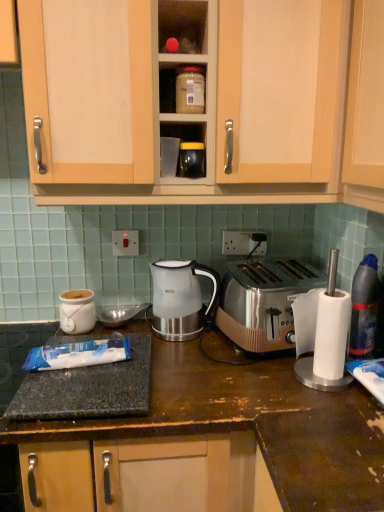
The width and height of the screenshot is (384, 512). I want to click on satin silver toaster at right, so click(328, 335).

In order to face satin silver kettle at center, should I rotate leftwards or rightwards?

To align with it, rotate left about 1.465°.

You are a GUI agent. You are given a task and a screenshot of the screen. Output one action in this format:
    pyautogui.click(x=<x>, y=<y>)
    Task: Click on the satin silver kettle at center
    
    Given the screenshot: What is the action you would take?
    pyautogui.click(x=180, y=298)

Identify the location of satin silver toaster at center. This screenshot has width=384, height=512. (263, 301).

Locate an element on the screen. blue glossy bottle at right is located at coordinates (364, 308).

Image resolution: width=384 pixels, height=512 pixels. What do you see at coordinates (190, 400) in the screenshot? I see `granite dark brown at lower left` at bounding box center [190, 400].

The height and width of the screenshot is (512, 384). Identify the location of satin silver toaster at right. (328, 335).

Is matte black jar at center, which ranks as the second appliance in bottom-to-top order, spatially inside granite dark brown at lower left, or outside of it?

matte black jar at center, which ranks as the second appliance in bottom-to-top order, cannot be found inside granite dark brown at lower left.

From a real-world perspective, which object rests below the other?

granite dark brown at lower left, from a real-world perspective.

Considering the sizes of objects matte black jar at center, which appears as the first appliance when viewed from the top, and granite dark brown at lower left in the image provided, who is taller, matte black jar at center, which appears as the first appliance when viewed from the top, or granite dark brown at lower left?

granite dark brown at lower left.

From the image's perspective, relative to white plastic socket at center, placed as the second electric outlet when sorted from front to back, is satin silver kettle at center above or below?

satin silver kettle at center is situated lower than white plastic socket at center, placed as the second electric outlet when sorted from front to back, in the image.

How different are the orientations of satin silver kettle at center and white plastic socket at center, which is the second electric outlet from left to right, in degrees?

The angular difference between satin silver kettle at center and white plastic socket at center, which is the second electric outlet from left to right, is 1.02 degrees.

Would you consider satin silver kettle at center to be distant from white plastic socket at center, the first electric outlet from the back?

No.

Based on the photo, which object is more forward, satin silver kettle at center or white plastic socket at center, which is the first electric outlet from right to left?

Positioned in front is satin silver kettle at center.

Considering the relative positions of matte plastic container at upper center and matte white ceramic jar at left, arranged as the 1th appliance when viewed from the left, in the image provided, is matte plastic container at upper center to the left or to the right of matte white ceramic jar at left, arranged as the 1th appliance when viewed from the left,?

From the image, it's evident that matte plastic container at upper center is to the right of matte white ceramic jar at left, arranged as the 1th appliance when viewed from the left.

Can you tell me how much matte plastic container at upper center and matte white ceramic jar at left, which is counted as the first appliance, starting from the back, differ in facing direction?

The facing directions of matte plastic container at upper center and matte white ceramic jar at left, which is counted as the first appliance, starting from the back, are 2.08 degrees apart.

From a real-world perspective, is matte plastic container at upper center physically located above or below matte white ceramic jar at left, positioned as the second appliance in front-to-back order?

matte plastic container at upper center is situated higher than matte white ceramic jar at left, positioned as the second appliance in front-to-back order, in the real world.

Is matte plastic container at upper center facing towards matte white ceramic jar at left, the second appliance from the right?

No, matte plastic container at upper center is not oriented towards matte white ceramic jar at left, the second appliance from the right.

In terms of width, does matte wood cabinet at upper center look wider or thinner when compared to matte plastic container at upper center?

matte wood cabinet at upper center is wider than matte plastic container at upper center.

Consider the image. Is matte wood cabinet at upper center not inside matte plastic container at upper center?

Yes, matte wood cabinet at upper center is located beyond the bounds of matte plastic container at upper center.

From a real-world perspective, which is physically above, matte wood cabinet at upper center or matte plastic container at upper center?

matte wood cabinet at upper center.

Find the location of `appliance above the white plastic socket at center, placed as the second electric outlet when sorted from front to back (from the image's perspective)`. appliance above the white plastic socket at center, placed as the second electric outlet when sorted from front to back (from the image's perspective) is located at coordinates (192, 160).

Looking at the image, does white plastic socket at center, which is the second electric outlet from left to right, seem bigger or smaller compared to matte black jar at center, which appears as the first appliance when viewed from the top?

In the image, white plastic socket at center, which is the second electric outlet from left to right, appears to be smaller than matte black jar at center, which appears as the first appliance when viewed from the top.

Which is in front, white plastic socket at center, the first electric outlet from the back, or matte black jar at center, the first appliance when ordered from front to back?

matte black jar at center, the first appliance when ordered from front to back, is in front.

How much distance is there between white plastic socket at center, which is the second electric outlet from left to right, and matte black jar at center, the first appliance when ordered from front to back?

15.64 inches.

Which is in front, point (47, 439) or point (230, 249)?

The point (47, 439) is in front.

Considering the sizes of granite dark brown at lower left and white plastic socket at center, the first electric outlet from the back, in the image, is granite dark brown at lower left wider or thinner than white plastic socket at center, the first electric outlet from the back,?

Considering their sizes, granite dark brown at lower left looks broader than white plastic socket at center, the first electric outlet from the back.

In the scene shown: Could you tell me if granite dark brown at lower left is facing white plastic socket at center, the first electric outlet from the back?

No, granite dark brown at lower left is not facing towards white plastic socket at center, the first electric outlet from the back.

Between matte black jar at center, the first appliance when ordered from front to back, and satin silver toaster at right, which one has smaller size?

With smaller size is matte black jar at center, the first appliance when ordered from front to back.

Is matte black jar at center, which ranks as the second appliance in back-to-front order, positioned far away from satin silver toaster at right?

No, matte black jar at center, which ranks as the second appliance in back-to-front order, is not far from satin silver toaster at right.

Is satin silver toaster at right at the back of matte black jar at center, which ranks as the second appliance in bottom-to-top order?

That's not correct — matte black jar at center, which ranks as the second appliance in bottom-to-top order, is not looking away from satin silver toaster at right.

From a real-world perspective, which object rests below the other?

satin silver toaster at right, from a real-world perspective.

Locate an element on the screen. appliance on the right of granite dark brown at lower left is located at coordinates (192, 160).

I want to click on coffeepot in front of the white plastic socket at center, placed as the second electric outlet when sorted from front to back, so [x=180, y=298].

Estimate the real-world distances between objects in this image. Which object is closer to white plastic socket at center, which is the first electric outlet from right to left, matte wood cabinet at upper center or satin silver kettle at center?

satin silver kettle at center is closer to white plastic socket at center, which is the first electric outlet from right to left.

Which object lies further to the anchor point satin silver kettle at center, white plastic socket at center, which is the first electric outlet from right to left, or satin silver toaster at center?

Among the two, white plastic socket at center, which is the first electric outlet from right to left, is located further to satin silver kettle at center.

Consider the image. From the image, which object appears to be farther from white plastic socket at center, placed as the second electric outlet when sorted from front to back, satin silver toaster at right or satin silver kettle at center?

The object further to white plastic socket at center, placed as the second electric outlet when sorted from front to back, is satin silver toaster at right.

Considering their positions, is matte black jar at center, which appears as the first appliance when viewed from the top, positioned closer to granite dark brown at lower left than white plastic electric outlet at center, the 1th electric outlet positioned from the front?

Among the two, white plastic electric outlet at center, the 1th electric outlet positioned from the front, is located nearer to granite dark brown at lower left.

Based on their spatial positions, is matte white ceramic jar at left, which is counted as the first appliance, starting from the back, or matte black jar at center, placed as the second appliance when sorted from left to right, further from blue glossy bottle at right?

The object further to blue glossy bottle at right is matte white ceramic jar at left, which is counted as the first appliance, starting from the back.

Which object lies further to the anchor point matte black jar at center, which ranks as the second appliance in back-to-front order, satin silver kettle at center or satin silver toaster at right?

satin silver toaster at right is positioned further to the anchor matte black jar at center, which ranks as the second appliance in back-to-front order.

From the image, which object appears to be farther from white plastic electric outlet at center, the 1th electric outlet viewed from the left, blue glossy bottle at right or matte plastic container at upper center?

blue glossy bottle at right is positioned further to the anchor white plastic electric outlet at center, the 1th electric outlet viewed from the left.

When comparing their distances from satin silver toaster at center, does matte black jar at center, which ranks as the second appliance in back-to-front order, or matte plastic container at upper center seem further?

The object further to satin silver toaster at center is matte plastic container at upper center.

At what (x,y) coordinates should I click in order to perform the action: click on appliance that lies between matte wood cabinet at upper center and matte white ceramic jar at left, positioned as the second appliance in front-to-back order, from top to bottom. Please return your answer as a coordinate pair (x, y). Image resolution: width=384 pixels, height=512 pixels. Looking at the image, I should click on (192, 160).

The height and width of the screenshot is (512, 384). Identify the location of blender between matte white ceramic jar at left, positioned as the second appliance in front-to-back order, and blue glossy bottle at right. (328, 335).

The width and height of the screenshot is (384, 512). I want to click on blender between satin silver kettle at center and blue glossy bottle at right in the horizontal direction, so click(x=328, y=335).

Where is `coffeepot between matte white ceramic jar at left, which ranks as the 2th appliance in top-to-bottom order, and white plastic socket at center, which is the first electric outlet from right to left, from left to right`? The width and height of the screenshot is (384, 512). coffeepot between matte white ceramic jar at left, which ranks as the 2th appliance in top-to-bottom order, and white plastic socket at center, which is the first electric outlet from right to left, from left to right is located at coordinates (180, 298).